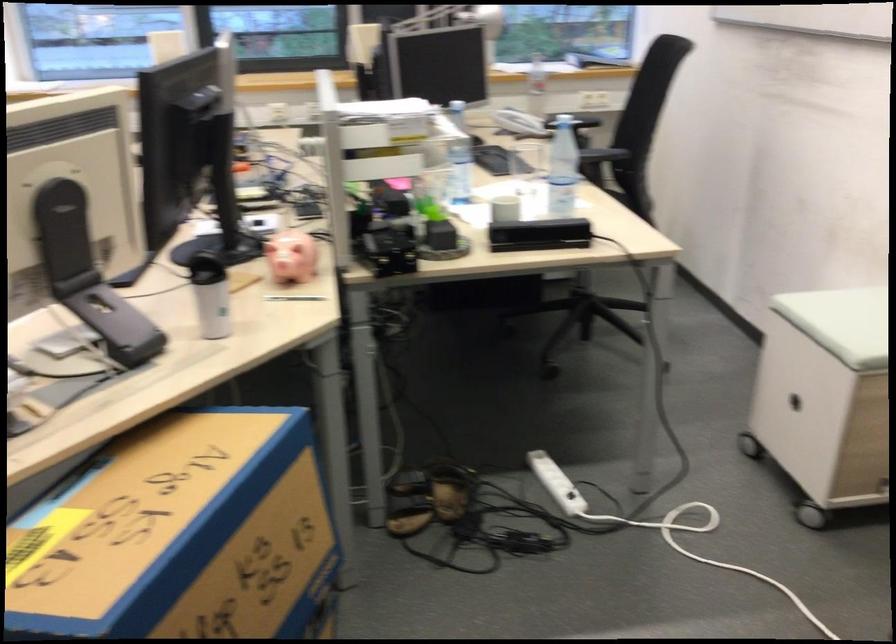
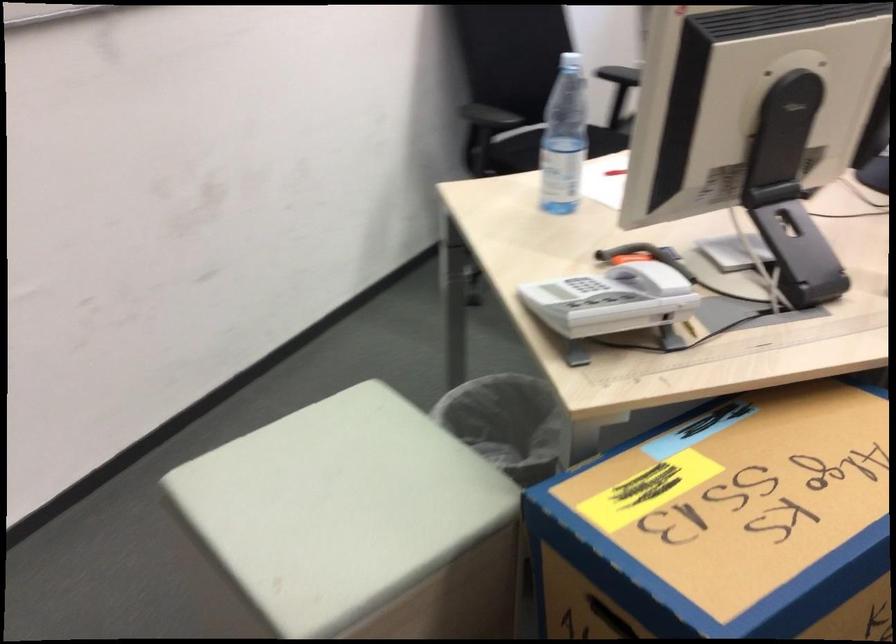
Question: How did the camera likely rotate?

Choices:
 (A) Left
 (B) Right
 (C) Up
 (D) Down

Answer: (A)